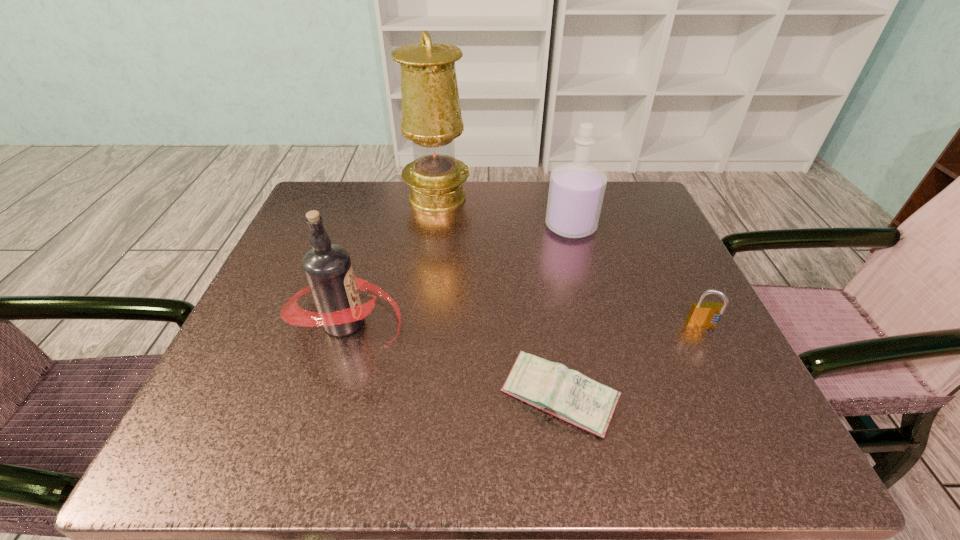
The height and width of the screenshot is (540, 960). What are the coordinates of `free space at the left edge of the desktop` in the screenshot? It's located at tap(234, 338).

Locate an element on the screen. free space at the right edge of the desktop is located at coordinates (659, 259).

Locate an element on the screen. The image size is (960, 540). blank space at the far left corner is located at coordinates (318, 201).

Identify the location of vacant space at the far right corner. This screenshot has height=540, width=960. point(596,230).

The image size is (960, 540). Find the location of `free space between the tallest object and the perfume`. free space between the tallest object and the perfume is located at coordinates (504, 212).

Locate an element on the screen. This screenshot has width=960, height=540. free area in between the perfume and the oil lamp is located at coordinates (504, 212).

Locate an element on the screen. The width and height of the screenshot is (960, 540). vacant region between the tallest object and the root beer is located at coordinates (392, 260).

Identify the location of empty location between the diary and the perfume. The width and height of the screenshot is (960, 540). (564, 312).

This screenshot has width=960, height=540. What are the coordinates of `vacant area between the root beer and the tallest object` in the screenshot? It's located at (392, 260).

The width and height of the screenshot is (960, 540). I want to click on empty space that is in between the fourth tallest object and the root beer, so click(x=524, y=324).